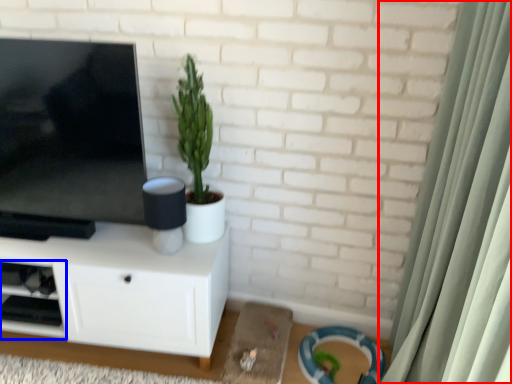
Question: Which object is further to the camera taking this photo, curtain (highlighted by a red box) or shelf (highlighted by a blue box)?

Choices:
 (A) curtain
 (B) shelf

Answer: (B)